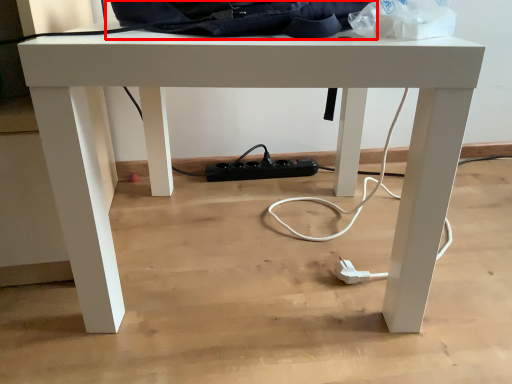
Question: From the image's perspective, where is messenger bag (annotated by the red box) located in relation to paper bag in the image?

Choices:
 (A) above
 (B) below

Answer: (A)